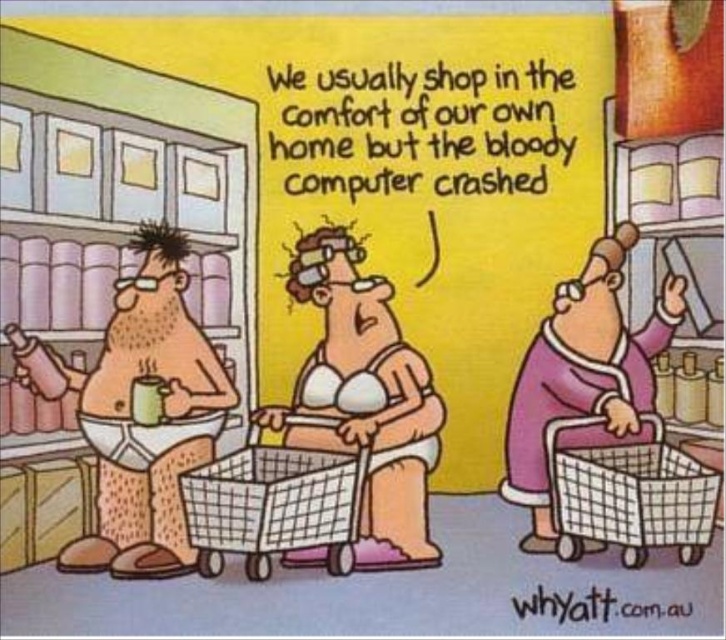
Question: Which point appears closest to the camera in this image?

Choices:
 (A) (250, 534)
 (B) (391, 557)
 (C) (613, 241)
 (D) (113, 314)

Answer: (A)

Question: Which object appears farthest from the camera in this image?

Choices:
 (A) plastic mesh shopping cart at lower right
 (B) brown paper bag at left
 (C) white mesh shopping cart at center

Answer: (C)

Question: Does white mesh shopping cart at center have a greater width compared to plastic mesh shopping cart at lower right?

Choices:
 (A) no
 (B) yes

Answer: (B)

Question: From the image, what is the correct spatial relationship of brown paper bag at left in relation to white mesh shopping cart at center?

Choices:
 (A) below
 (B) above

Answer: (B)

Question: Can you confirm if brown paper bag at left is positioned to the left of plastic mesh shopping cart at lower right?

Choices:
 (A) yes
 (B) no

Answer: (A)

Question: Which point appears closest to the camera in this image?

Choices:
 (A) (566, 429)
 (B) (191, 496)
 (C) (309, 436)

Answer: (B)